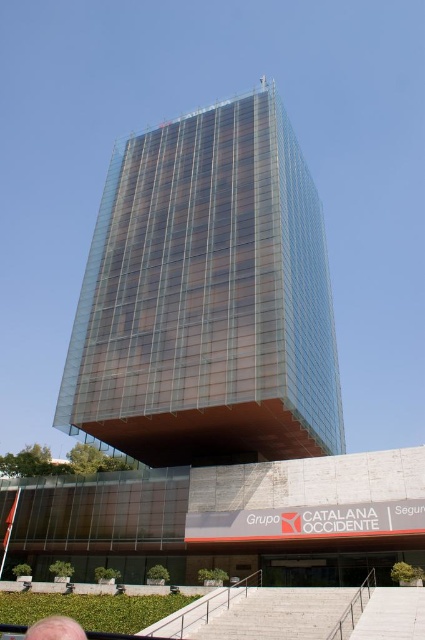
You are standing in front of the transparent glass tower at center and want to take a photo of the blonde hair at lower left. Which object should you focus on first to ensure both are in the frame?

You should focus on the transparent glass tower at center first because it is closer to you than the blonde hair at lower left, ensuring both are in the frame.

You are a visitor approaching the transparent glass tower at center and notice the blonde hair at lower left in the foreground. Which object appears larger in the image?

The transparent glass tower at center appears larger than the blonde hair at lower left because it is much taller.

You are standing at the entrance of the transparent glass tower at center. If you look directly ahead, will you see the landscaped area with grass and potted plants or the clear blue sky?

The transparent glass tower at center is located at point (207, 298), so when standing at its entrance and looking ahead, you would see the landscaped area with grass and potted plants in front of the building, not the sky above.